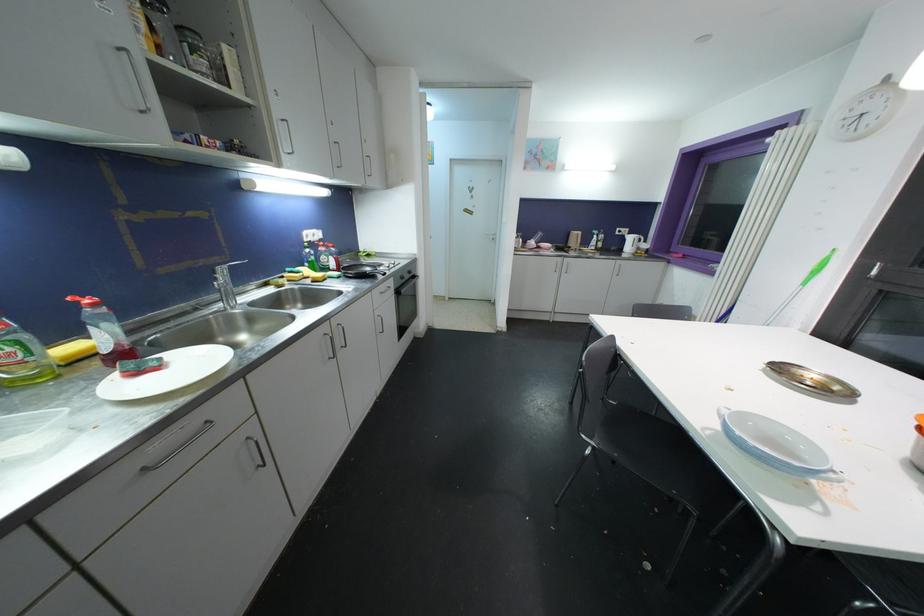
At what (x,y) coordinates should I click in order to perform the action: click on green soap bottle. Please return your answer as a coordinate pair (x, y). The width and height of the screenshot is (924, 616). Looking at the image, I should click on (22, 357).